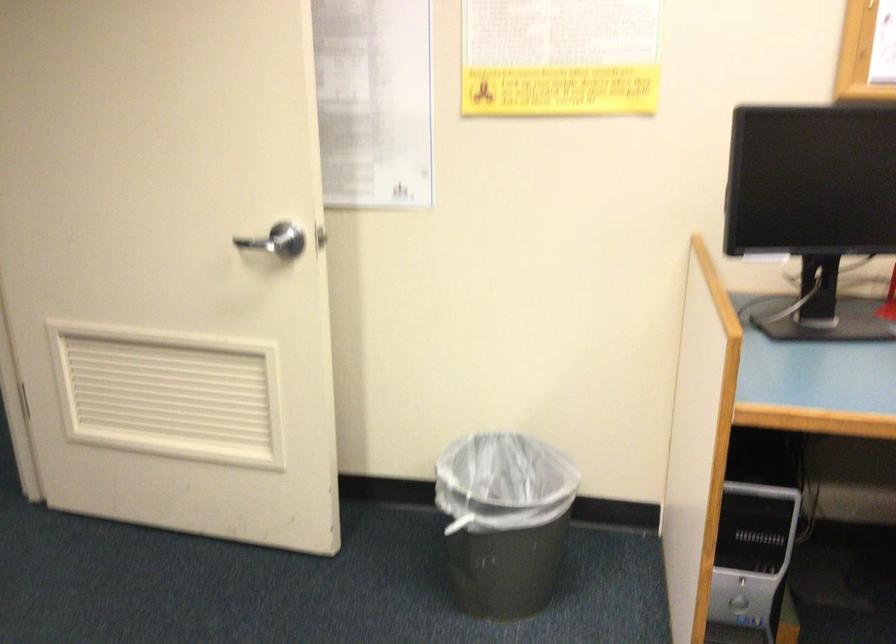
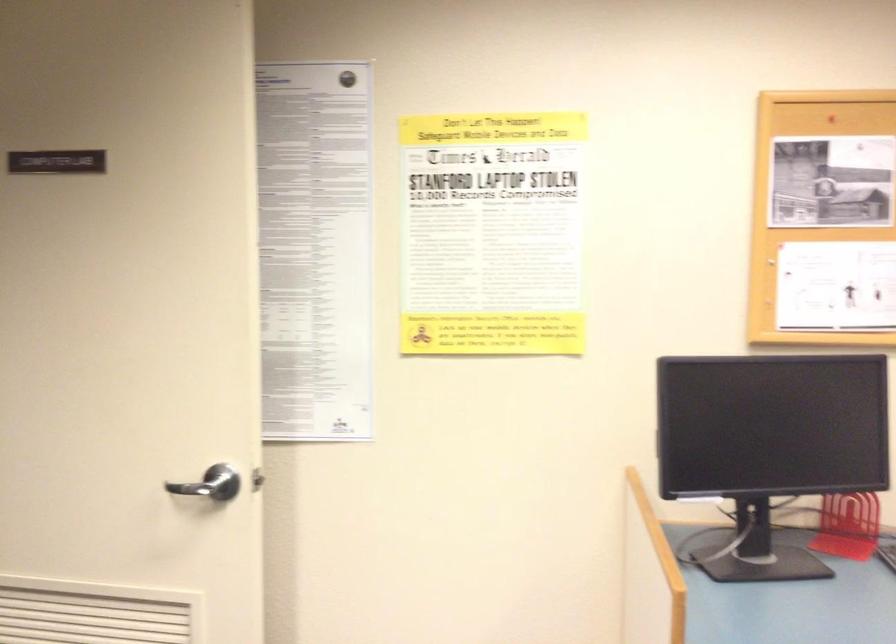
Question: How did the camera likely rotate?

Choices:
 (A) Left
 (B) Right
 (C) Up
 (D) Down

Answer: (C)